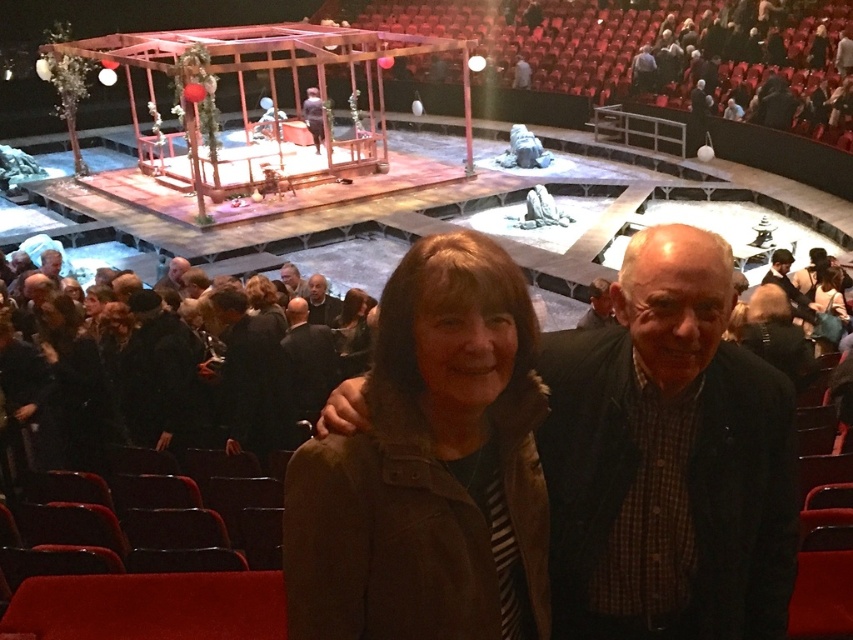
Question: Which object is farther from the camera taking this photo?

Choices:
 (A) dark brown hair at center
 (B) gray wool sweater at center
 (C) smooth brown leather jacket at lower center
 (D) brown leather jacket at lower center

Answer: (C)

Question: Is brown leather jacket at lower center smaller than dark brown leather jacket at upper right?

Choices:
 (A) yes
 (B) no

Answer: (B)

Question: Which of the following is the farthest from the observer?

Choices:
 (A) dark brown hair at center
 (B) matte black jacket at lower right
 (C) light brown hair at center
 (D) smooth brown leather jacket at lower center

Answer: (C)

Question: Which point is closer to the camera taking this photo?

Choices:
 (A) (709, 624)
 (B) (279, 276)
 (C) (260, 275)
 (D) (312, 282)

Answer: (A)

Question: Considering the relative positions of dark brown hair at center and smooth brown leather jacket at lower center in the image provided, where is dark brown hair at center located with respect to smooth brown leather jacket at lower center?

Choices:
 (A) right
 (B) left

Answer: (A)

Question: Where is dark brown textured jacket at center located in relation to dark brown hair at center in the image?

Choices:
 (A) above
 (B) below

Answer: (B)